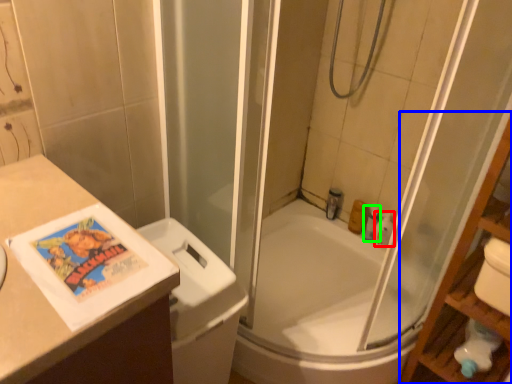
Question: Considering the real-world distances, which object is closest to toiletry (highlighted by a red box)? shelf (highlighted by a blue box) or toiletry (highlighted by a green box).

Choices:
 (A) shelf
 (B) toiletry

Answer: (B)